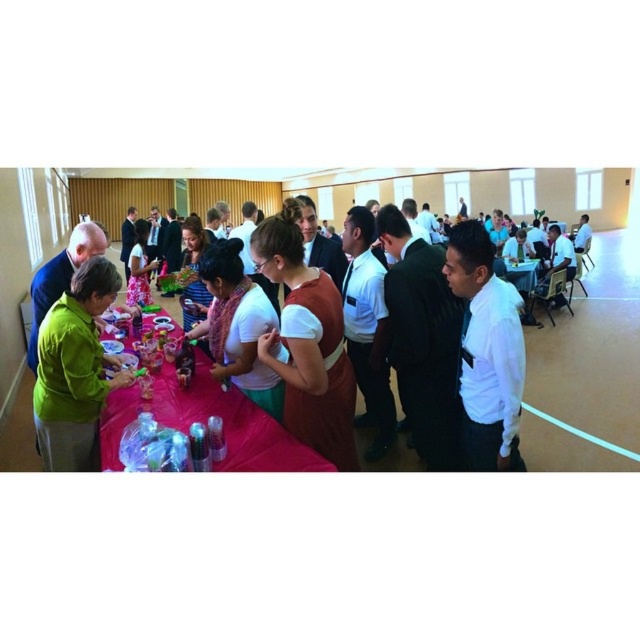
Question: Can you confirm if green fabric tablecloth at left is smaller than green matte shirt at lower left?

Choices:
 (A) no
 (B) yes

Answer: (A)

Question: Which point is farther from the camera taking this photo?

Choices:
 (A) (522, 296)
 (B) (560, 234)

Answer: (B)

Question: Is white shirt at center wider than green matte jacket at left?

Choices:
 (A) no
 (B) yes

Answer: (A)

Question: Which point is closer to the camera?

Choices:
 (A) pink fabric table at center
 (B) white shirt at right

Answer: (B)

Question: Which object appears closest to the camera in this image?

Choices:
 (A) white shirt at center
 (B) white matte shirt at center

Answer: (A)

Question: Where is floral dress at center located in relation to white shirt at right in the image?

Choices:
 (A) left
 (B) right

Answer: (A)